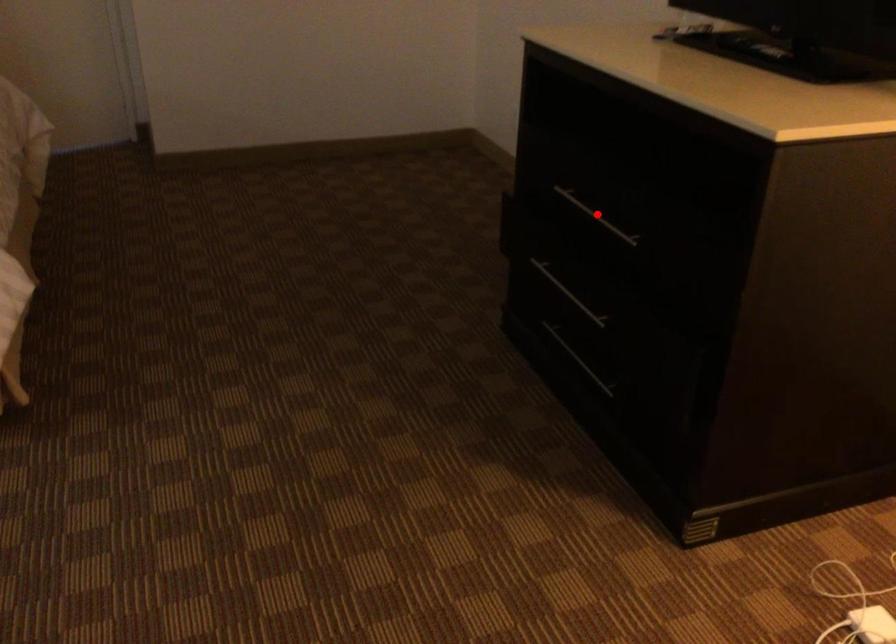
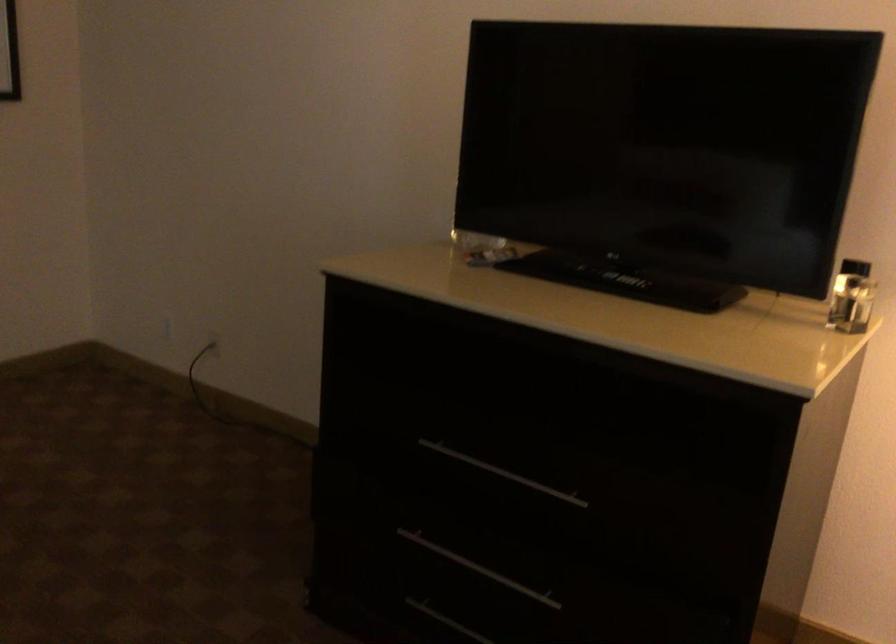
Question: I am providing you with two images of the same scene from different viewpoints. A red point is shown in image1. For the corresponding object point in image2, is it positioned nearer or farther from the camera?

Choices:
 (A) Nearer
 (B) Farther

Answer: (A)